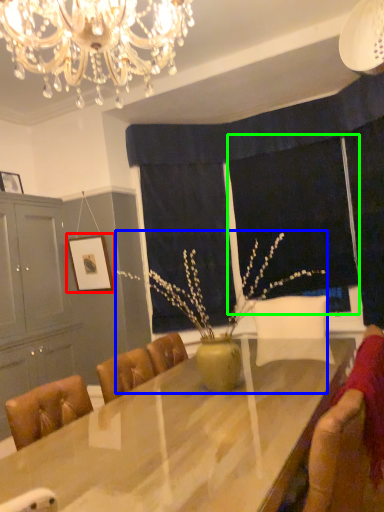
Question: Which object is the farthest from picture frame (highlighted by a red box)? Choose among these: floral arrangement (highlighted by a blue box) or window screen (highlighted by a green box).

Choices:
 (A) floral arrangement
 (B) window screen

Answer: (B)